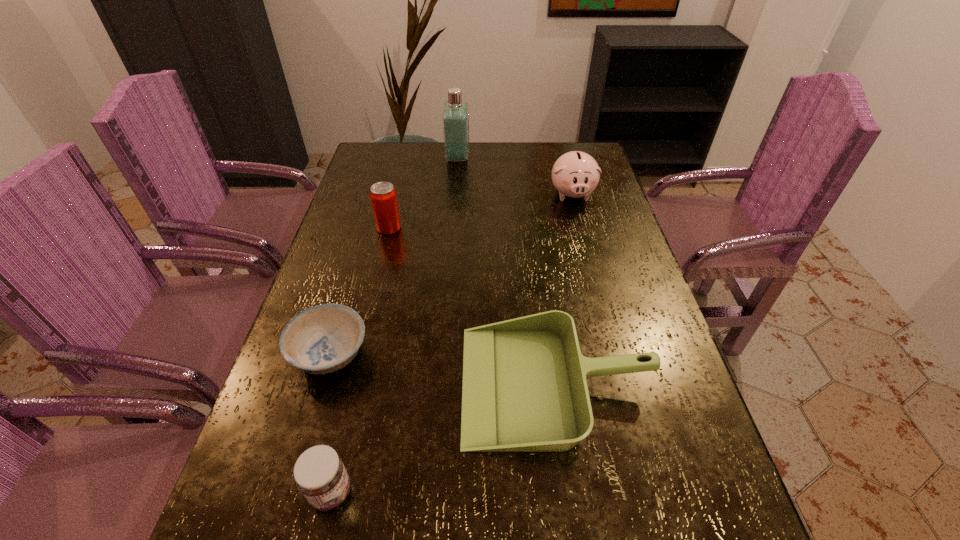
Identify the location of perfume. The image size is (960, 540). (455, 118).

Where is `the farthest object`? the farthest object is located at coordinates (455, 118).

At what (x,y) coordinates should I click in order to perform the action: click on piggy bank. Please return your answer as a coordinate pair (x, y). Looking at the image, I should click on (575, 174).

At what (x,y) coordinates should I click in order to perform the action: click on the fourth nearest object. Please return your answer as a coordinate pair (x, y). The height and width of the screenshot is (540, 960). Looking at the image, I should click on (383, 196).

The height and width of the screenshot is (540, 960). What are the coordinates of `jam` in the screenshot? It's located at (319, 472).

The width and height of the screenshot is (960, 540). I want to click on dustpan, so 524,389.

Locate an element on the screen. Image resolution: width=960 pixels, height=540 pixels. bowl is located at coordinates (322, 339).

Where is `free spot located on the front label of the perfume`? The height and width of the screenshot is (540, 960). free spot located on the front label of the perfume is located at coordinates (568, 158).

The height and width of the screenshot is (540, 960). Find the location of `free region located 0.370m on the front of the fifth nearest object`. free region located 0.370m on the front of the fifth nearest object is located at coordinates (600, 300).

Where is `vacant space situated on the right of the fourth nearest object`? vacant space situated on the right of the fourth nearest object is located at coordinates (449, 228).